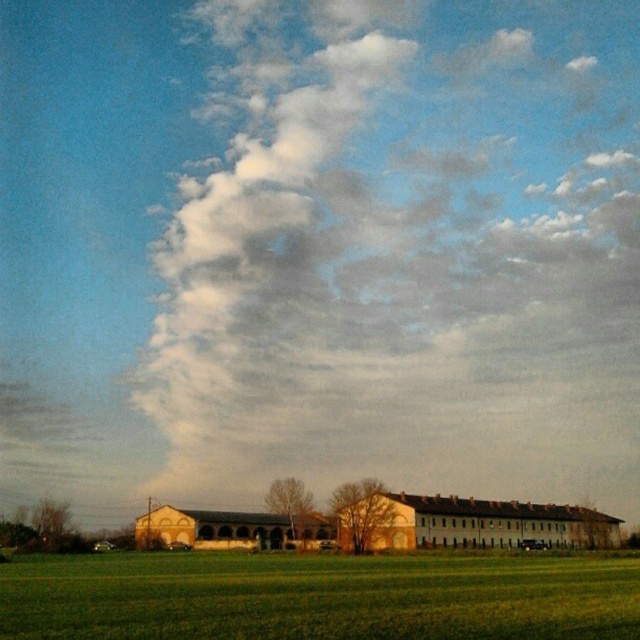
Who is lower down, white fluffy cloud at upper center or beige brick barn at center?

beige brick barn at center is below.

Identify the location of white fluffy cloud at upper center. (406, 257).

Describe the element at coordinates (406, 257) in the screenshot. I see `white fluffy cloud at upper center` at that location.

This screenshot has width=640, height=640. Find the location of `white fluffy cloud at upper center`. white fluffy cloud at upper center is located at coordinates (406, 257).

Does white fluffy cloud at upper center appear over brown textured barn at center?

Yes.

Is point (260, 440) farther from camera compared to point (150, 516)?

Yes, it is.

What are the coordinates of `white fluffy cloud at upper center` in the screenshot? It's located at (406, 257).

Is green grass at lower center shorter than beige brick barn at center?

No.

Is point (497, 634) behind point (584, 515)?

That is False.

You are a GUI agent. You are given a task and a screenshot of the screen. Output one action in this format:
    pyautogui.click(x=<x>, y=<y>)
    Task: Click on the green grass at lower center
    The height and width of the screenshot is (640, 640).
    Given the screenshot: What is the action you would take?
    click(x=321, y=596)